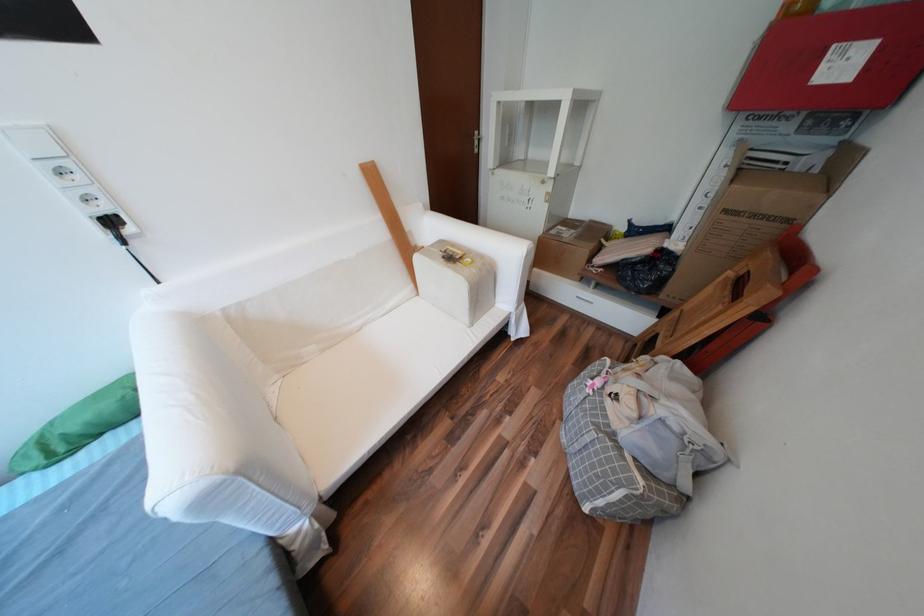
Locate an element on the screen. Image resolution: width=924 pixels, height=616 pixels. white drawer handle is located at coordinates (590, 302).